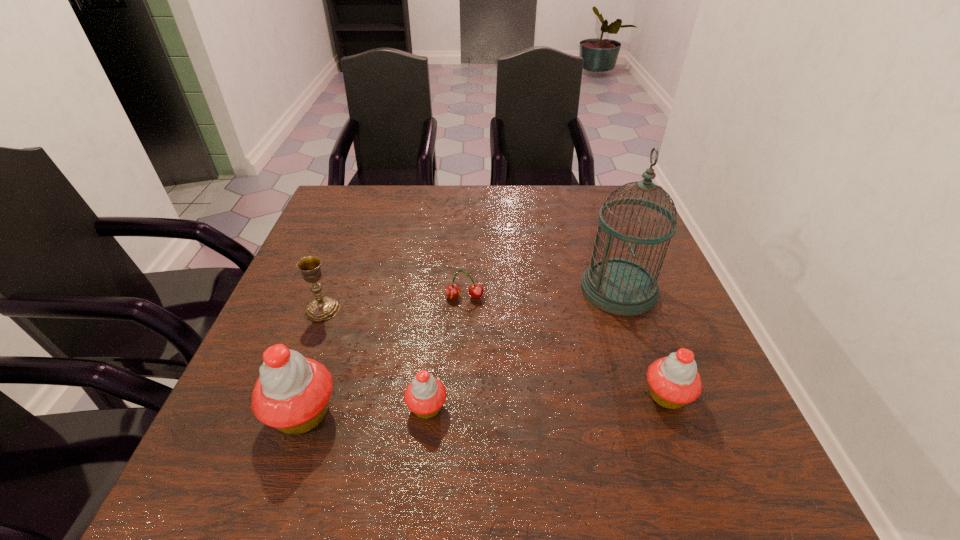
The image size is (960, 540). In order to click on the tallest cupcake in this screenshot , I will do `click(292, 394)`.

Find the location of a particular element. Image resolution: width=960 pixels, height=540 pixels. the leftmost cupcake is located at coordinates (292, 394).

Locate an element on the screen. The image size is (960, 540). the shortest cupcake is located at coordinates (425, 395).

This screenshot has width=960, height=540. In order to click on the second tallest cupcake in this screenshot , I will do `click(674, 381)`.

Identify the location of the shortest object. click(x=452, y=291).

You are a GUI agent. You are given a task and a screenshot of the screen. Output one action in this format:
    pyautogui.click(x=<x>, y=<y>)
    Task: Click on the chalice
    The width and height of the screenshot is (960, 540).
    Given the screenshot: What is the action you would take?
    pyautogui.click(x=322, y=308)

The width and height of the screenshot is (960, 540). I want to click on birdcage, so click(619, 286).

Find the location of `blank area located 0.080m on the right of the tallest cupcake`. blank area located 0.080m on the right of the tallest cupcake is located at coordinates (383, 413).

The height and width of the screenshot is (540, 960). Find the location of `free point located 0.260m on the right of the second cupcake from right to left`. free point located 0.260m on the right of the second cupcake from right to left is located at coordinates (588, 407).

You are a GUI agent. You are given a task and a screenshot of the screen. Output one action in this format:
    pyautogui.click(x=<x>, y=<y>)
    Task: Click on the free space located 0.130m on the back of the second shortest cupcake
    
    Given the screenshot: What is the action you would take?
    pyautogui.click(x=641, y=326)